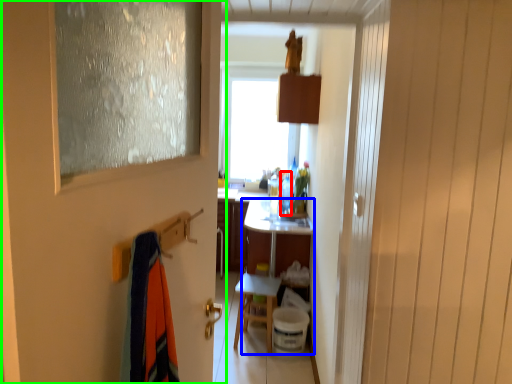
Question: Considering the real-world distances, which object is closest to bottle (highlighted by a red box)? vanity (highlighted by a blue box) or door (highlighted by a green box).

Choices:
 (A) vanity
 (B) door

Answer: (A)